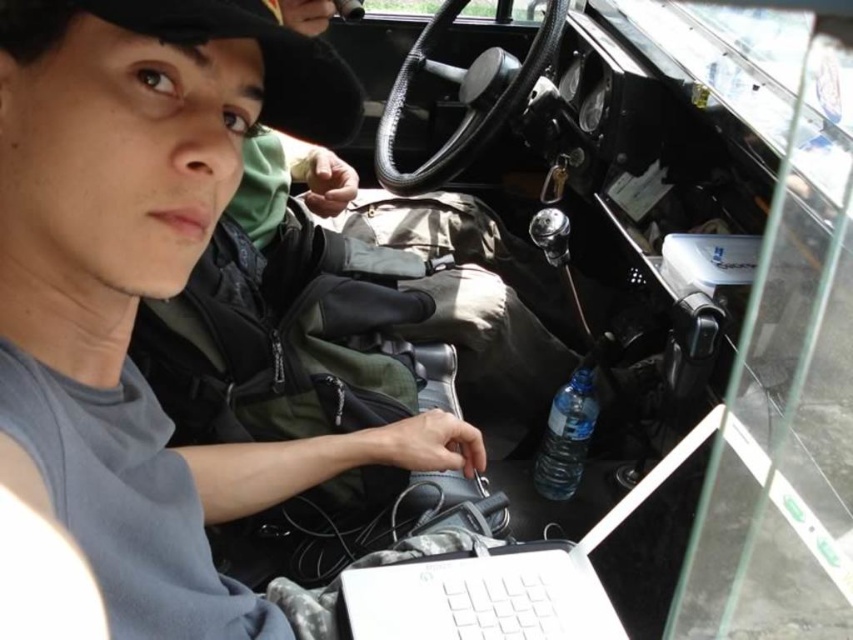
Question: Where is white plastic laptop at center located in relation to clear plastic bottle at lower right in the image?

Choices:
 (A) below
 (B) above

Answer: (A)

Question: Can you confirm if white plastic laptop at center is positioned to the left of clear plastic bottle at lower right?

Choices:
 (A) no
 (B) yes

Answer: (B)

Question: Does white plastic laptop at center appear on the left side of clear plastic bottle at lower right?

Choices:
 (A) yes
 (B) no

Answer: (A)